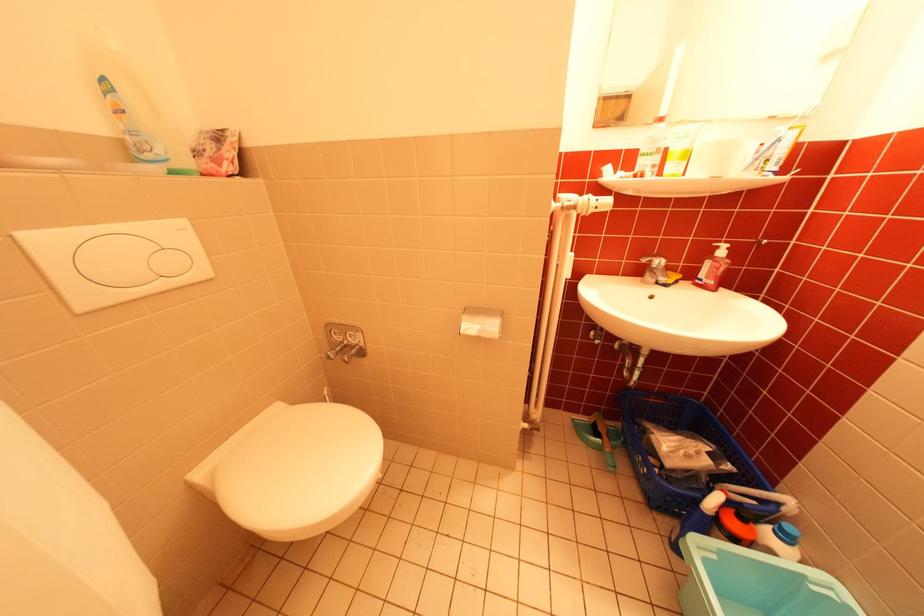
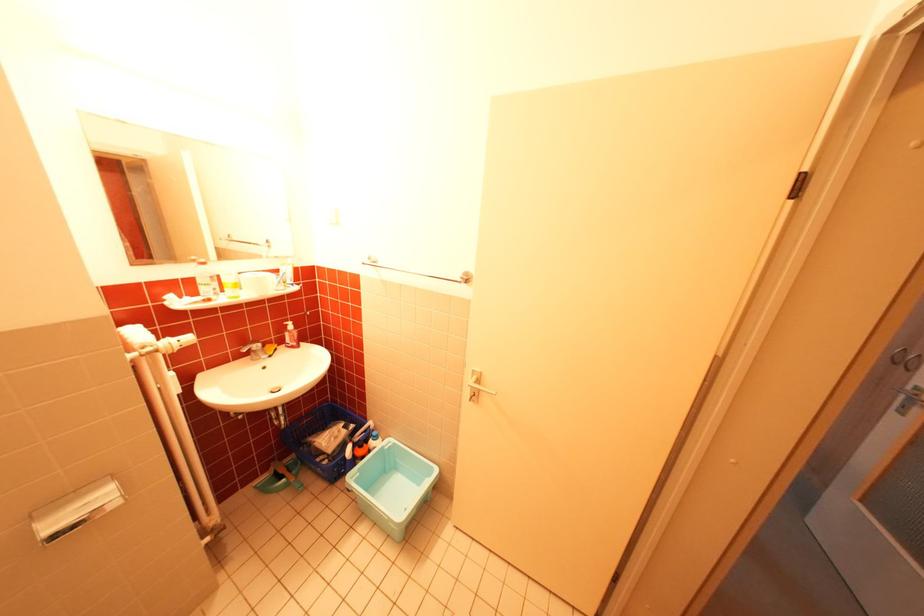
In the second image, find the point that corresponds to the point at 731,553 in the first image.

(370, 471)